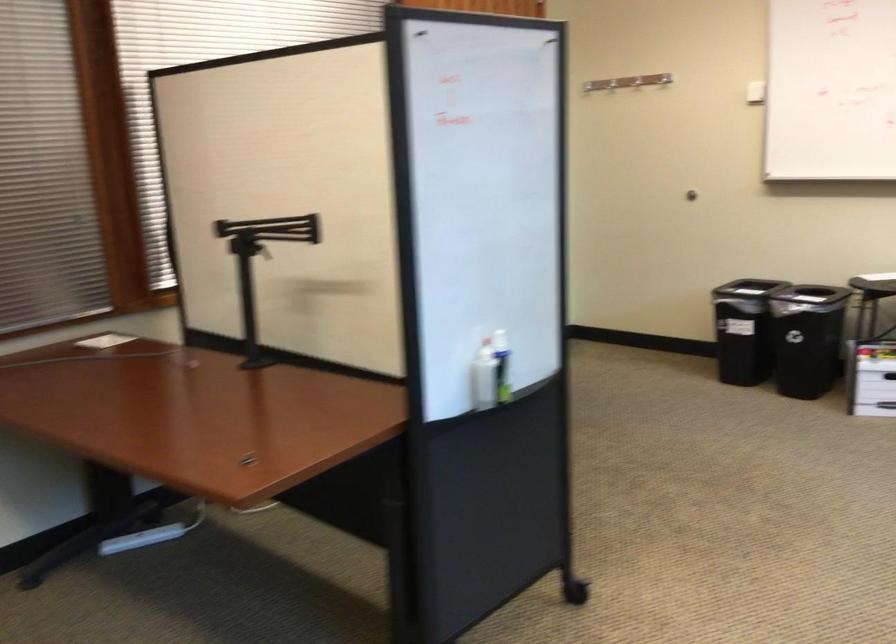
Locate an element on the screen. This screenshot has height=644, width=896. white power strip is located at coordinates pyautogui.click(x=141, y=538).